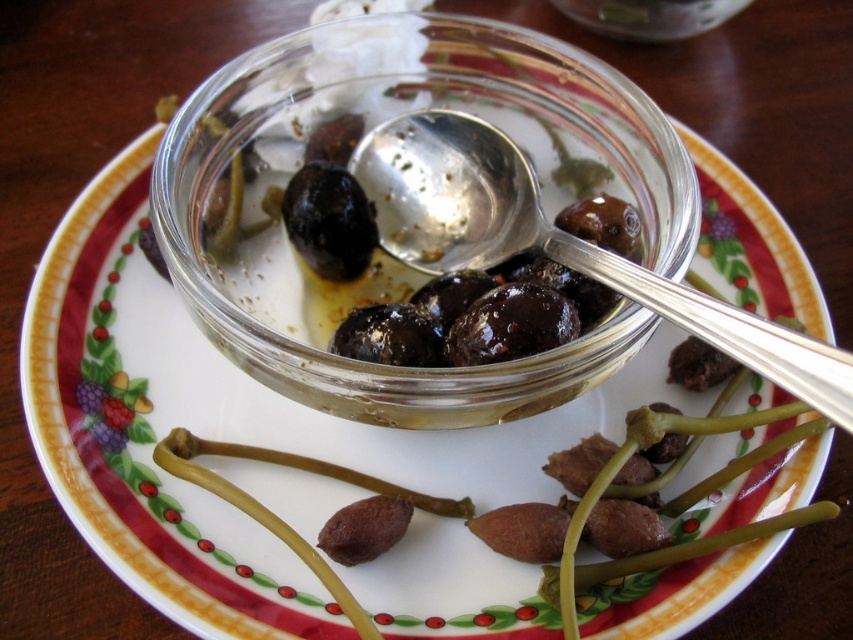
Does silver metallic spoon at center come behind shiny black olive at center?

No, it is in front of shiny black olive at center.

Consider the image. Can you confirm if silver metallic spoon at center is bigger than shiny black olive at center?

Indeed, silver metallic spoon at center has a larger size compared to shiny black olive at center.

Where is `silver metallic spoon at center`? The width and height of the screenshot is (853, 640). silver metallic spoon at center is located at coordinates (555, 244).

Who is positioned more to the left, transparent glass bowl at center or shiny black olive at center?

From the viewer's perspective, shiny black olive at center appears more on the left side.

Describe the element at coordinates (375, 124) in the screenshot. The width and height of the screenshot is (853, 640). I see `transparent glass bowl at center` at that location.

Which is behind, point (280, 268) or point (334, 202)?

Positioned behind is point (334, 202).

Identify the location of transparent glass bowl at center. (375, 124).

What do you see at coordinates (375, 124) in the screenshot? I see `transparent glass bowl at center` at bounding box center [375, 124].

Is transparent glass bowl at center to the right of silver metallic spoon at center from the viewer's perspective?

In fact, transparent glass bowl at center is to the left of silver metallic spoon at center.

Between point (212, 132) and point (437, 272), which one is positioned behind?

The point (437, 272) is behind.

I want to click on transparent glass bowl at center, so click(375, 124).